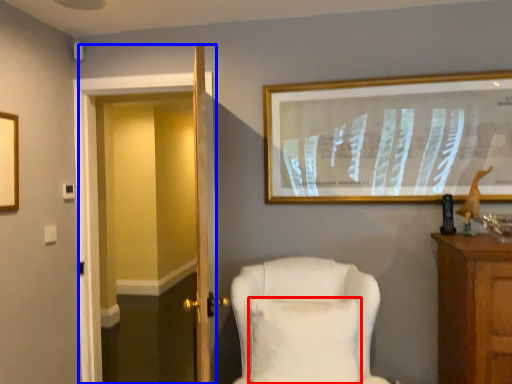
Question: Which of the following is the farthest to the observer, pillow (highlighted by a red box) or glass door (highlighted by a blue box)?

Choices:
 (A) pillow
 (B) glass door

Answer: (B)